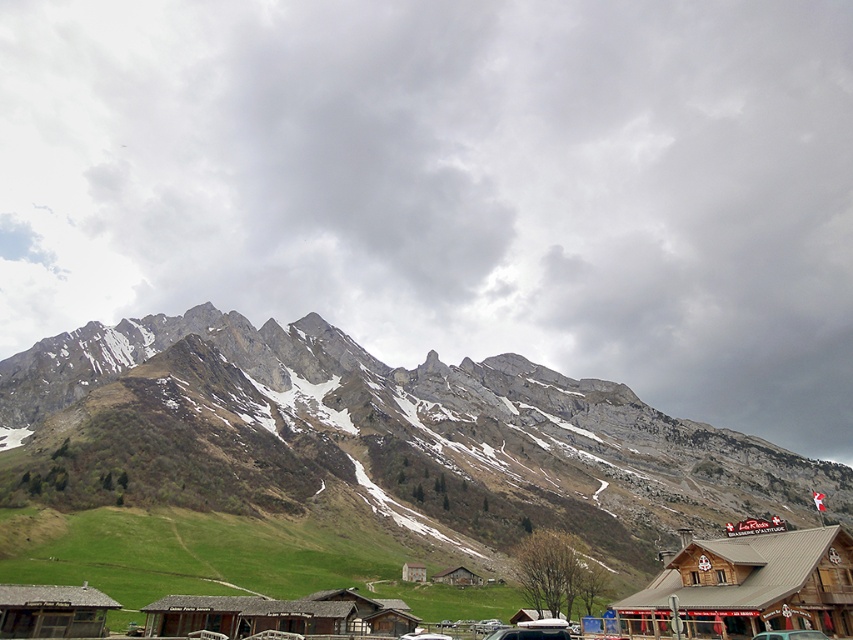
Question: Which point is farther to the camera?

Choices:
 (A) (546, 625)
 (B) (697, 472)
 (C) (276, 616)
 (D) (527, 138)

Answer: (D)

Question: Can you confirm if cloudy gray sky at upper center is smaller than wooden cabin at center?

Choices:
 (A) no
 (B) yes

Answer: (A)

Question: Which of the following is the farthest from the observer?

Choices:
 (A) cloudy gray sky at upper center
 (B) brown wooden hut at center

Answer: (A)

Question: Can you confirm if wooden hut at lower left is bigger than wooden cabin at center?

Choices:
 (A) no
 (B) yes

Answer: (B)

Question: From the image, what is the correct spatial relationship of wooden hut at lower left in relation to brown wooden hut at center?

Choices:
 (A) left
 (B) right

Answer: (A)

Question: Among these objects, which one is nearest to the camera?

Choices:
 (A) brown wooden hut at lower center
 (B) wooden hut at lower left

Answer: (B)